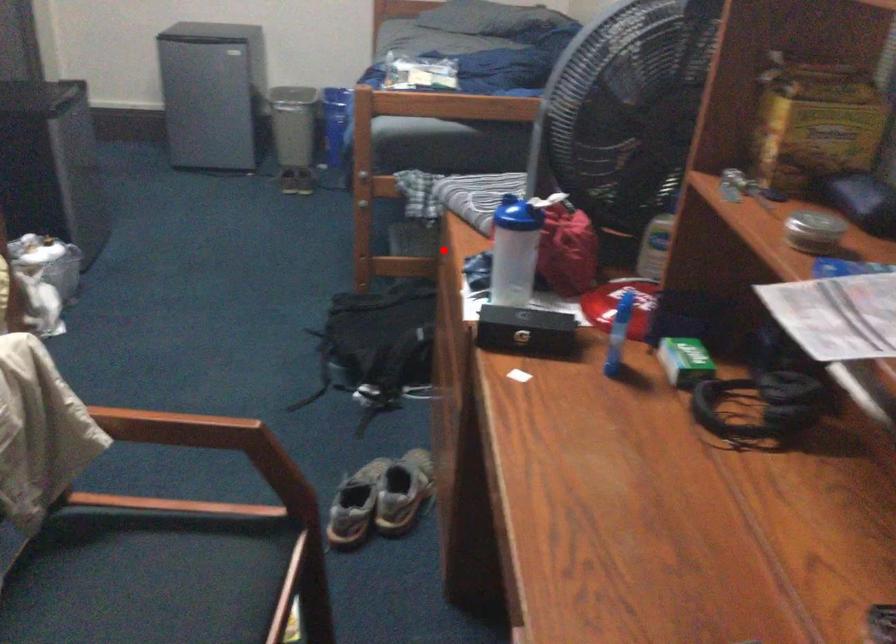
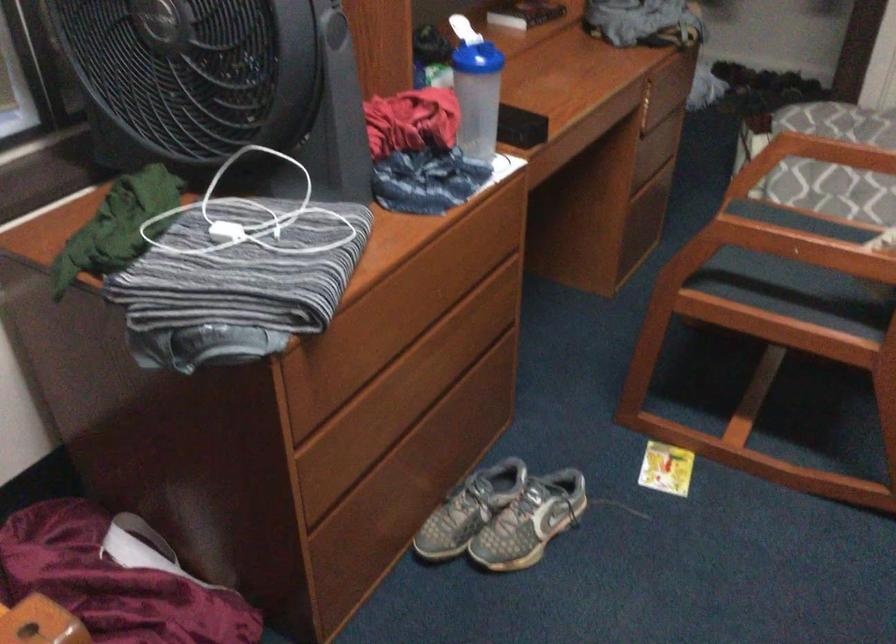
Question: I am providing you with two images of the same scene from different viewpoints. Image1 has a red point marked. In image2, the corresponding 3D location appears at what relative position? Reply with the corresponding letter.

Choices:
 (A) Closer
 (B) Farther

Answer: (A)